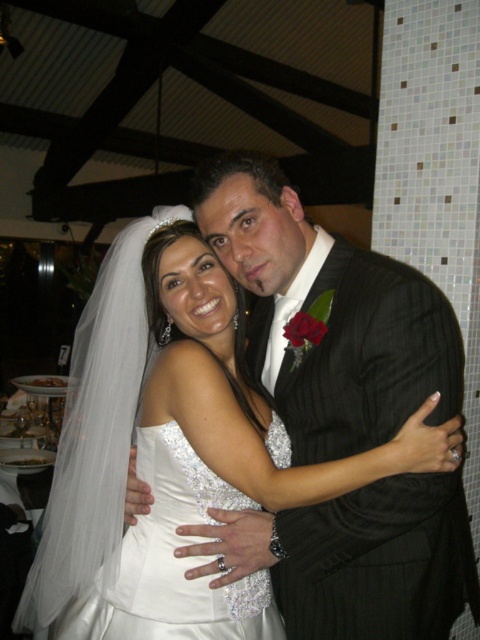
Consider the image. Which is below, matte black suit at center or white satin dress at center?

white satin dress at center is below.

Between point (206, 216) and point (164, 596), which one is positioned behind?

Point (206, 216)

Locate an element on the screen. matte black suit at center is located at coordinates (330, 314).